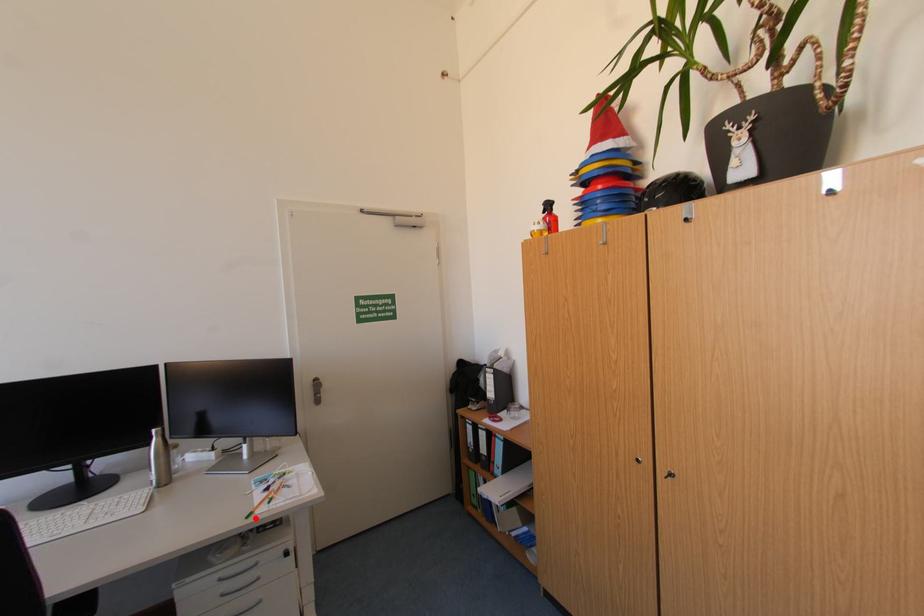
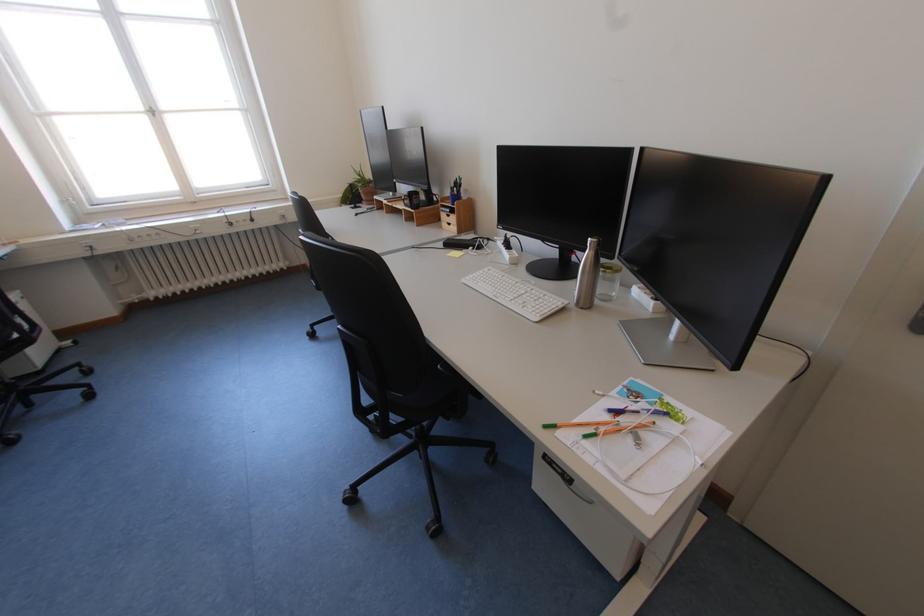
The point at the highlighted location is marked in the first image. Where is the corresponding point in the second image?

(553, 428)